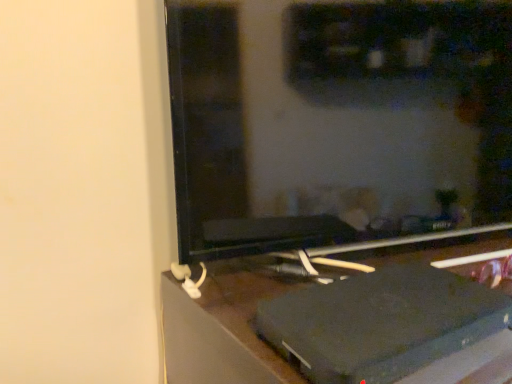
The image size is (512, 384). What do you see at coordinates (347, 319) in the screenshot?
I see `black plastic laptop at lower right` at bounding box center [347, 319].

In order to click on black plastic laptop at lower right in this screenshot , I will do `click(347, 319)`.

You are a GUI agent. You are given a task and a screenshot of the screen. Output one action in this format:
    pyautogui.click(x=<x>, y=<y>)
    Task: Click on the black matte computer monitor at center
    
    Given the screenshot: What is the action you would take?
    pyautogui.click(x=337, y=120)

Measure the distance between black matte computer monitor at center and camera.

The depth of black matte computer monitor at center is 22.38 inches.

Describe the element at coordinates (337, 120) in the screenshot. I see `black matte computer monitor at center` at that location.

At what (x,y) coordinates should I click in order to perform the action: click on black plastic laptop at lower right. Please return your answer as a coordinate pair (x, y). The width and height of the screenshot is (512, 384). Looking at the image, I should click on (347, 319).

Which object is positioned more to the left, black matte computer monitor at center or black plastic laptop at lower right?

black matte computer monitor at center.

Which is in front, black matte computer monitor at center or black plastic laptop at lower right?

black plastic laptop at lower right is closer to the camera.

Is point (250, 25) closer to camera compared to point (386, 351)?

That is False.

From the image's perspective, is black matte computer monitor at center above black plastic laptop at lower right?

Indeed, from the image's perspective, black matte computer monitor at center is shown above black plastic laptop at lower right.

From a real-world perspective, is black matte computer monitor at center physically above black plastic laptop at lower right?

Indeed, from a real-world perspective, black matte computer monitor at center stands above black plastic laptop at lower right.

Considering the sizes of objects black matte computer monitor at center and black plastic laptop at lower right in the image provided, who is wider, black matte computer monitor at center or black plastic laptop at lower right?

With larger width is black plastic laptop at lower right.

Who is taller, black matte computer monitor at center or black plastic laptop at lower right?

With more height is black plastic laptop at lower right.

Can you confirm if black matte computer monitor at center is bigger than black plastic laptop at lower right?

Incorrect, black matte computer monitor at center is not larger than black plastic laptop at lower right.

Is black matte computer monitor at center inside the boundaries of black plastic laptop at lower right, or outside?

black matte computer monitor at center is outside black plastic laptop at lower right.

Is black matte computer monitor at center next to black plastic laptop at lower right?

No, black matte computer monitor at center is not with black plastic laptop at lower right.

Could you tell me if black matte computer monitor at center is facing black plastic laptop at lower right?

No, black matte computer monitor at center is not aimed at black plastic laptop at lower right.

What's the angular difference between black matte computer monitor at center and black plastic laptop at lower right's facing directions?

The facing directions of black matte computer monitor at center and black plastic laptop at lower right are 14.6 degrees apart.

Identify the location of furniture below the black matte computer monitor at center (from the image's perspective). The height and width of the screenshot is (384, 512). (347, 319).

Considering the positions of objects black plastic laptop at lower right and black matte computer monitor at center in the image provided, who is more to the left, black plastic laptop at lower right or black matte computer monitor at center?

From the viewer's perspective, black matte computer monitor at center appears more on the left side.

Considering the positions of objects black plastic laptop at lower right and black matte computer monitor at center in the image provided, who is behind, black plastic laptop at lower right or black matte computer monitor at center?

black matte computer monitor at center.

Considering the points (507, 277) and (498, 52), which point is behind, point (507, 277) or point (498, 52)?

Point (498, 52)

From the image's perspective, relative to black matte computer monitor at center, is black plastic laptop at lower right above or below?

Based on their image positions, black plastic laptop at lower right is located beneath black matte computer monitor at center.

From a real-world perspective, is black plastic laptop at lower right positioned under black matte computer monitor at center based on gravity?

Yes, from a real-world perspective, black plastic laptop at lower right is under black matte computer monitor at center.

Between black plastic laptop at lower right and black matte computer monitor at center, which one has smaller width?

Thinner between the two is black matte computer monitor at center.

Is black plastic laptop at lower right taller or shorter than black matte computer monitor at center?

In the image, black plastic laptop at lower right appears to be taller than black matte computer monitor at center.

Can you confirm if black plastic laptop at lower right is bigger than black matte computer monitor at center?

Indeed, black plastic laptop at lower right has a larger size compared to black matte computer monitor at center.

Is black plastic laptop at lower right completely or partially outside of black matte computer monitor at center?

Indeed, black plastic laptop at lower right is completely outside black matte computer monitor at center.

Is black plastic laptop at lower right touching black matte computer monitor at center?

No, black plastic laptop at lower right is not touching black matte computer monitor at center.

From the picture: Is black plastic laptop at lower right turned away from black matte computer monitor at center?

No, black matte computer monitor at center is not at the back of black plastic laptop at lower right.

How far apart are black plastic laptop at lower right and black matte computer monitor at center?

7.46 inches.

In the image, there is a black matte computer monitor at center. Where is `furniture below it (from a real-world perspective)`? furniture below it (from a real-world perspective) is located at coordinates (347, 319).

Locate an element on the screen. furniture below the black matte computer monitor at center (from a real-world perspective) is located at coordinates (347, 319).

Where is `furniture in front of the black matte computer monitor at center`? The image size is (512, 384). furniture in front of the black matte computer monitor at center is located at coordinates (347, 319).